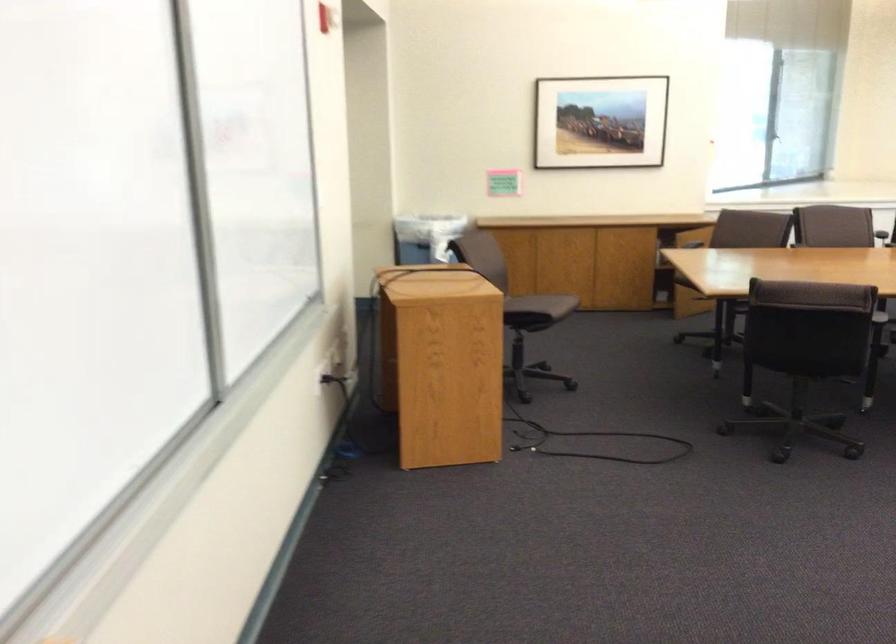
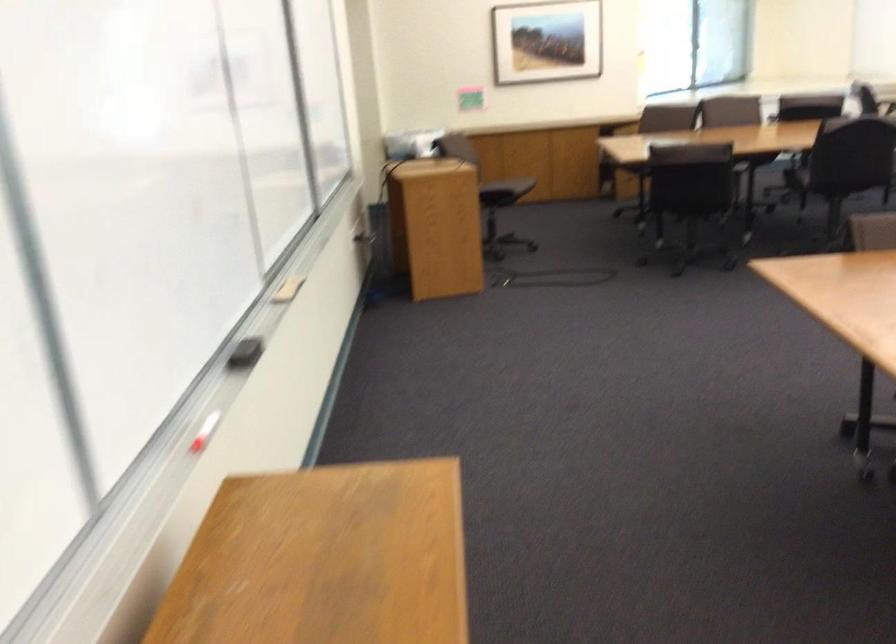
Where in the second image is the point corresponding to (x=823, y=337) from the first image?

(700, 176)